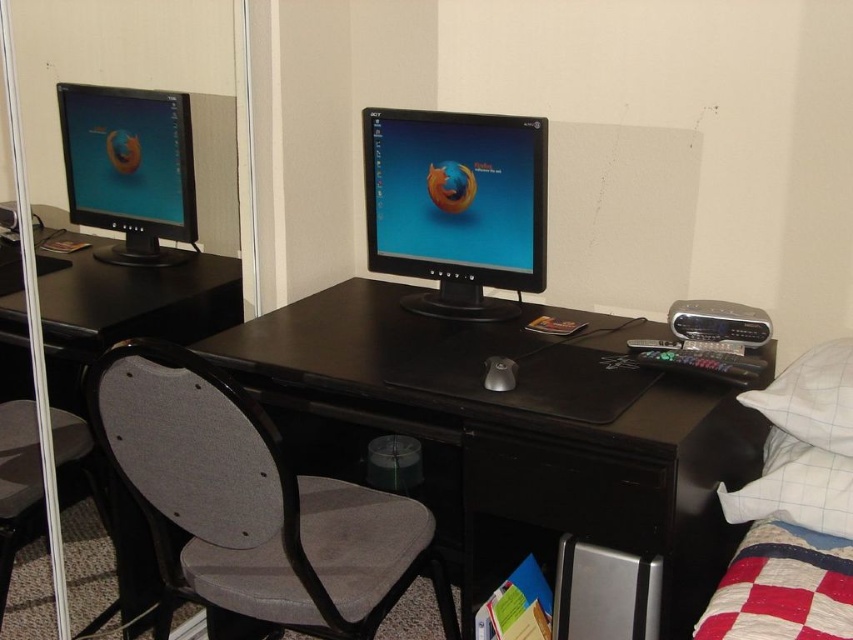
Can you confirm if gray fabric swivel chair at center is taller than black plastic drawer at center?

Indeed, gray fabric swivel chair at center has a greater height compared to black plastic drawer at center.

Does point (177, 557) come in front of point (561, 467)?

No.

Between point (225, 609) and point (560, 456), which one is positioned behind?

Positioned behind is point (560, 456).

Image resolution: width=853 pixels, height=640 pixels. In order to click on gray fabric swivel chair at center in this screenshot , I will do `click(252, 504)`.

Which is more to the left, gray fabric swivel chair at center or gray fabric chair at left?

gray fabric chair at left

Measure the distance between point (357, 547) and camera.

A distance of 1.54 meters exists between point (357, 547) and camera.

Does point (349, 604) come closer to viewer compared to point (4, 449)?

That is True.

Image resolution: width=853 pixels, height=640 pixels. I want to click on gray fabric swivel chair at center, so click(252, 504).

Does matte black monitor at left appear on the right side of satin black mouse at center?

Incorrect, matte black monitor at left is not on the right side of satin black mouse at center.

Who is shorter, matte black monitor at left or satin black mouse at center?

satin black mouse at center is shorter.

The width and height of the screenshot is (853, 640). I want to click on matte black monitor at left, so click(x=129, y=168).